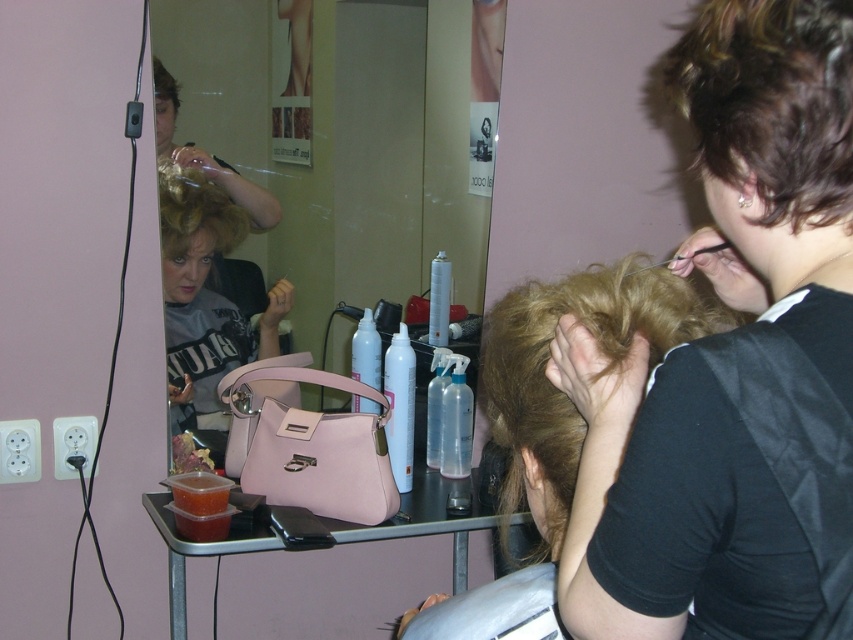
Is blonde silky hair at center smaller than curly blonde hair at upper center?

Actually, blonde silky hair at center might be larger than curly blonde hair at upper center.

Does blonde silky hair at center have a greater width compared to curly blonde hair at upper center?

Yes.

Is point (498, 401) closer to camera compared to point (235, 230)?

Yes.

The image size is (853, 640). I want to click on blonde silky hair at center, so click(x=560, y=388).

Does dark brown hair at upper right have a lesser height compared to curly blonde hair at upper center?

No.

Between dark brown hair at upper right and curly blonde hair at upper center, which one has more height?

dark brown hair at upper right

Who is more distant from viewer, (764, 125) or (164, 208)?

Point (164, 208)

What are the coordinates of `dark brown hair at upper right` in the screenshot? It's located at click(733, 364).

Does pink leather handbag at center appear under curly blonde hair at upper center?

Incorrect, pink leather handbag at center is not positioned below curly blonde hair at upper center.

Is pink leather handbag at center in front of curly blonde hair at upper center?

Yes, pink leather handbag at center is in front of curly blonde hair at upper center.

Who is more distant from viewer, (x=227, y=44) or (x=199, y=172)?

Point (x=199, y=172)

The width and height of the screenshot is (853, 640). I want to click on pink leather handbag at center, so click(347, 138).